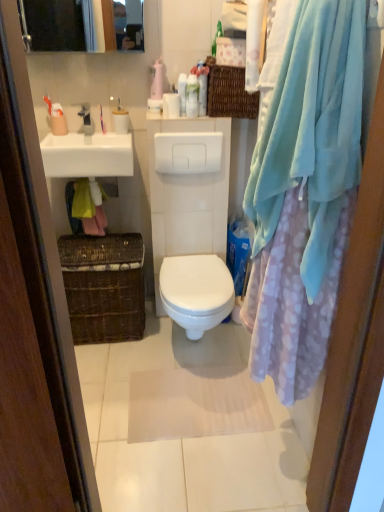
What do you see at coordinates (196, 292) in the screenshot?
I see `white glossy toilet at center` at bounding box center [196, 292].

Where is `white glossy toilet at center`? white glossy toilet at center is located at coordinates (196, 292).

Describe the element at coordinates (182, 93) in the screenshot. This screenshot has height=512, width=384. I see `white glossy lotion at upper center, which is counted as the 3th toiletry, starting from the right` at that location.

Describe the element at coordinates (202, 94) in the screenshot. I see `white glossy lotion at upper center, which appears as the sixth toiletry when viewed from the left` at that location.

Identify the location of satin silver faucet at upper center. This screenshot has width=384, height=512. (86, 120).

Where is `yellow fabric at lower left`? The width and height of the screenshot is (384, 512). yellow fabric at lower left is located at coordinates (84, 217).

From a real-world perspective, which object stands above the other?

white glossy lotion at upper center, the fourth toiletry from the left, is physically above.

Is white glossy toilet at center not inside white glossy lotion at upper center, the fourth toiletry from the left?

Yes, white glossy toilet at center is located beyond the bounds of white glossy lotion at upper center, the fourth toiletry from the left.

Measure the distance between white glossy toilet at center and white glossy lotion at upper center, which is counted as the 3th toiletry, starting from the right.

The distance of white glossy toilet at center from white glossy lotion at upper center, which is counted as the 3th toiletry, starting from the right, is 32.67 inches.

Between white glossy toilet at center and white glossy lotion at upper center, the fourth toiletry from the left, which one has smaller size?

white glossy lotion at upper center, the fourth toiletry from the left.

Is white glossy bottle at upper center, which is the second toiletry in right-to-left order, located outside white glossy lotion at upper center, the fourth toiletry from the left?

Yes.

Based on their positions, is white glossy bottle at upper center, the fifth toiletry positioned from the left, located to the left or right of white glossy lotion at upper center, the fourth toiletry from the left?

In the image, white glossy bottle at upper center, the fifth toiletry positioned from the left, appears on the right side of white glossy lotion at upper center, the fourth toiletry from the left.

Are white glossy bottle at upper center, which is the second toiletry in right-to-left order, and white glossy lotion at upper center, the fourth toiletry from the left, located far from each other?

Actually, white glossy bottle at upper center, which is the second toiletry in right-to-left order, and white glossy lotion at upper center, the fourth toiletry from the left, are a little close together.

From a real-world perspective, count 1st toiletrys upward from the white glossy bottle at upper center, which is the second toiletry in right-to-left order, and point to it. Please provide its 2D coordinates.

[(182, 93)]

From a real-world perspective, which is physically above, matte plastic toothbrush at upper left, which is counted as the first toiletry, starting from the left, or matte plastic toothbrush at upper left, the 5th toiletry positioned from the right?

matte plastic toothbrush at upper left, the 5th toiletry positioned from the right, from a real-world perspective.

Is matte plastic toothbrush at upper left, which appears as the sixth toiletry when viewed from the right, closer to the viewer compared to matte plastic toothbrush at upper left, the 5th toiletry positioned from the right?

No, matte plastic toothbrush at upper left, which appears as the sixth toiletry when viewed from the right, is further to the viewer.

From the image's perspective, which one is positioned higher, matte plastic toothbrush at upper left, which is counted as the first toiletry, starting from the left, or matte plastic toothbrush at upper left, the second toiletry in the left-to-right sequence?

matte plastic toothbrush at upper left, the second toiletry in the left-to-right sequence, appears higher in the image.

Is matte plastic toothbrush at upper left, which is counted as the first toiletry, starting from the left, facing towards matte plastic toothbrush at upper left, the 5th toiletry positioned from the right?

No, matte plastic toothbrush at upper left, which is counted as the first toiletry, starting from the left, is not facing towards matte plastic toothbrush at upper left, the 5th toiletry positioned from the right.

Are white glossy toilet paper at upper center, the 4th toiletry viewed from the right, and white glossy sink at upper left beside each other?

No, white glossy toilet paper at upper center, the 4th toiletry viewed from the right, is not beside white glossy sink at upper left.

From the picture: Is white glossy toilet paper at upper center, the 3th toiletry viewed from the left, bigger or smaller than white glossy sink at upper left?

Considering their sizes, white glossy toilet paper at upper center, the 3th toiletry viewed from the left, takes up less space than white glossy sink at upper left.

What are the coordinates of `the 2nd toiletry counting from the right of the white glossy sink at upper left` in the screenshot? It's located at (171, 105).

From the picture: From a real-world perspective, is white glossy toilet paper at upper center, the 3th toiletry viewed from the left, under white glossy sink at upper left?

Incorrect, from a real-world perspective, white glossy toilet paper at upper center, the 3th toiletry viewed from the left, is higher than white glossy sink at upper left.

Is white glossy toilet at center located within matte white medicine cabinet at upper left?

That's incorrect, white glossy toilet at center is not inside matte white medicine cabinet at upper left.

From a real-world perspective, is matte white medicine cabinet at upper left physically above white glossy toilet at center?

Yes, from a real-world perspective, matte white medicine cabinet at upper left is on top of white glossy toilet at center.

Locate an element on the screen. This screenshot has height=512, width=384. medicine cabinet that is above the white glossy toilet at center (from a real-world perspective) is located at coordinates (82, 25).

Considering the sizes of objects matte white medicine cabinet at upper left and white glossy toilet at center in the image provided, who is smaller, matte white medicine cabinet at upper left or white glossy toilet at center?

matte white medicine cabinet at upper left is smaller.

Which object is wider, satin silver faucet at upper center or white glossy bottle at upper center, the fifth toiletry positioned from the left?

satin silver faucet at upper center is wider.

Is satin silver faucet at upper center aimed at white glossy bottle at upper center, the fifth toiletry positioned from the left?

No, satin silver faucet at upper center is not facing towards white glossy bottle at upper center, the fifth toiletry positioned from the left.

This screenshot has width=384, height=512. I want to click on tap below the white glossy bottle at upper center, the fifth toiletry positioned from the left (from a real-world perspective), so click(x=86, y=120).

Is satin silver faucet at upper center taller or shorter than white glossy bottle at upper center, which is the second toiletry in right-to-left order?

Clearly, satin silver faucet at upper center is shorter compared to white glossy bottle at upper center, which is the second toiletry in right-to-left order.

The image size is (384, 512). Find the location of `basket above the white glossy toilet paper at upper center, the 4th toiletry viewed from the right (from the image's perspective)`. basket above the white glossy toilet paper at upper center, the 4th toiletry viewed from the right (from the image's perspective) is located at coordinates (230, 94).

Considering the sizes of objects woven brown basket at upper center and white glossy toilet paper at upper center, the 4th toiletry viewed from the right, in the image provided, who is smaller, woven brown basket at upper center or white glossy toilet paper at upper center, the 4th toiletry viewed from the right,?

With smaller size is white glossy toilet paper at upper center, the 4th toiletry viewed from the right.

Consider the image. Is woven brown basket at upper center wider or thinner than white glossy toilet paper at upper center, the 3th toiletry viewed from the left?

In the image, woven brown basket at upper center appears to be wider than white glossy toilet paper at upper center, the 3th toiletry viewed from the left.

Considering the relative sizes of woven brown basket at upper center and white glossy toilet paper at upper center, the 4th toiletry viewed from the right, in the image provided, is woven brown basket at upper center shorter than white glossy toilet paper at upper center, the 4th toiletry viewed from the right,?

Incorrect, the height of woven brown basket at upper center does not fall short of that of white glossy toilet paper at upper center, the 4th toiletry viewed from the right.

What are the coordinates of `the 2nd toiletry to the left of the white glossy toilet at center, counting from the anchor's position` in the screenshot? It's located at (182, 93).

Which toiletry is the 3rd one when counting from the front of the white glossy lotion at upper center, which is counted as the 3th toiletry, starting from the right? Please provide its 2D coordinates.

[(192, 96)]

Which object lies further to the anchor point white glossy toilet at center, white glossy bottle at upper center, the fifth toiletry positioned from the left, or white glossy lotion at upper center, which appears as the sixth toiletry when viewed from the left?

white glossy lotion at upper center, which appears as the sixth toiletry when viewed from the left.

Considering their positions, is light blue plush bath towel at right positioned further to white glossy toilet at center than satin silver faucet at upper center?

The object further to white glossy toilet at center is satin silver faucet at upper center.

When comparing their distances from white glossy lotion at upper center, the 1th toiletry positioned from the right, does white glossy bottle at upper center, the fifth toiletry positioned from the left, or woven brown basket at upper center seem closer?

Based on the image, white glossy bottle at upper center, the fifth toiletry positioned from the left, appears to be nearer to white glossy lotion at upper center, the 1th toiletry positioned from the right.

Based on the photo, looking at the image, which one is located closer to white glossy toilet at center, woven brown basket at upper center or matte plastic screen door at left?

woven brown basket at upper center is positioned closer to the anchor white glossy toilet at center.

From the picture: Estimate the real-world distances between objects in this image. Which object is further from woven brown basket at upper center, white glossy lotion at upper center, which appears as the sixth toiletry when viewed from the left, or white glossy bottle at upper center, the fifth toiletry positioned from the left?

white glossy bottle at upper center, the fifth toiletry positioned from the left, is further to woven brown basket at upper center.

Which object lies nearer to the anchor point yellow fabric at lower left, matte plastic toothbrush at upper left, the 5th toiletry positioned from the right, or matte white medicine cabinet at upper left?

matte plastic toothbrush at upper left, the 5th toiletry positioned from the right, is positioned closer to the anchor yellow fabric at lower left.

Based on their spatial positions, is brown woven laundry basket at lower left or white glossy sink at upper left closer to white glossy lotion at upper center, the fourth toiletry from the left?

white glossy sink at upper left lies closer to white glossy lotion at upper center, the fourth toiletry from the left, than the other object.

Based on their spatial positions, is matte plastic toothbrush at upper left, which appears as the sixth toiletry when viewed from the right, or white glossy toilet paper at upper center, the 3th toiletry viewed from the left, closer to white glossy sink at upper left?

Among the two, matte plastic toothbrush at upper left, which appears as the sixth toiletry when viewed from the right, is located nearer to white glossy sink at upper left.

Find the location of a particular element. This screenshot has width=384, height=512. bidet between light blue plush bath towel at right and white glossy lotion at upper center, the fourth toiletry from the left, from front to back is located at coordinates (196, 292).

Locate an element on the screen. The height and width of the screenshot is (512, 384). medicine cabinet between satin silver faucet at upper center and white glossy lotion at upper center, which appears as the sixth toiletry when viewed from the left is located at coordinates (82, 25).

Find the location of a particular element. Image resolution: width=384 pixels, height=512 pixels. sink between yellow fabric at lower left and white glossy toilet paper at upper center, the 3th toiletry viewed from the left is located at coordinates (87, 149).

Locate an element on the screen. This screenshot has height=512, width=384. sink between woven brown basket at upper center and brown woven laundry basket at lower left in the vertical direction is located at coordinates (87, 149).